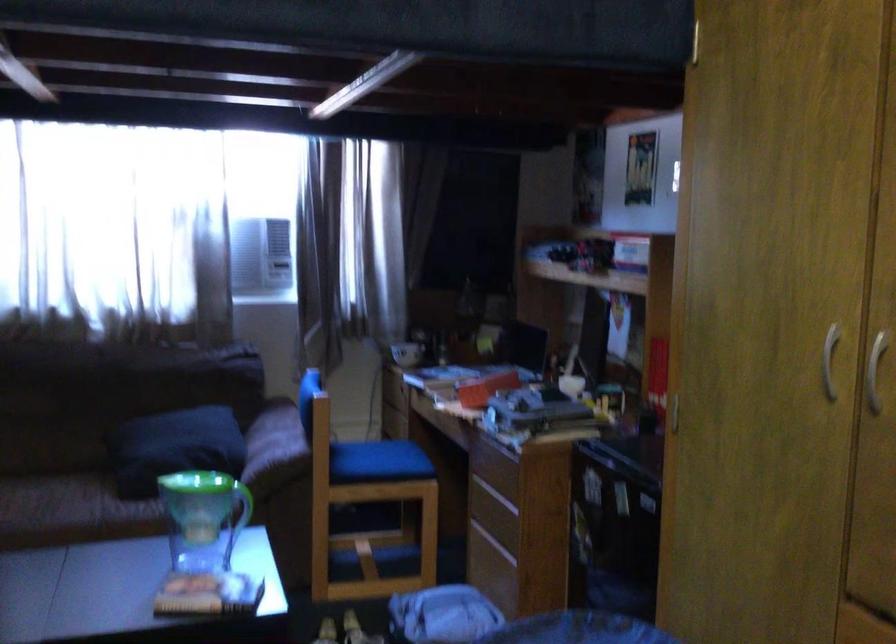
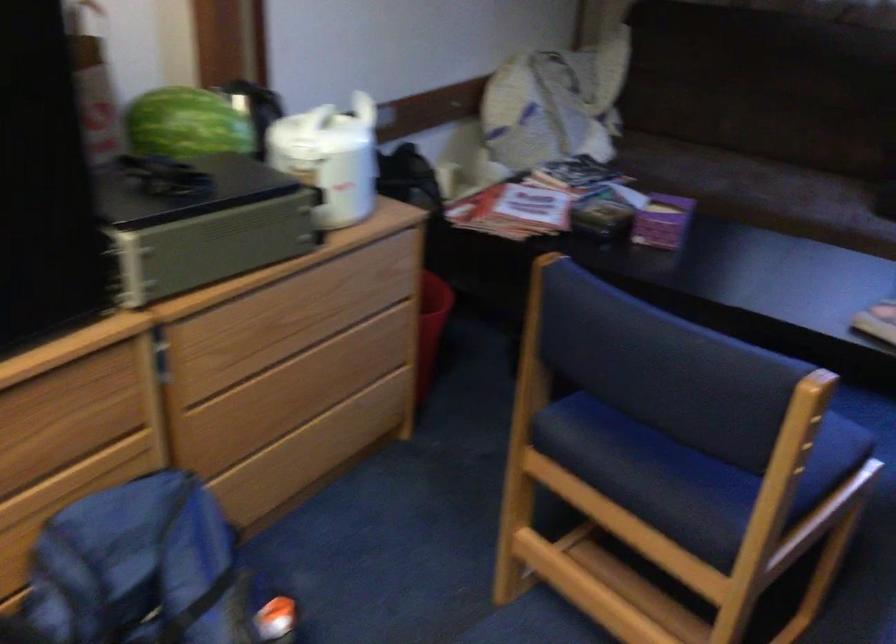
First-person continuous shooting, in which direction is the camera rotating?

The camera rotated toward left-down.